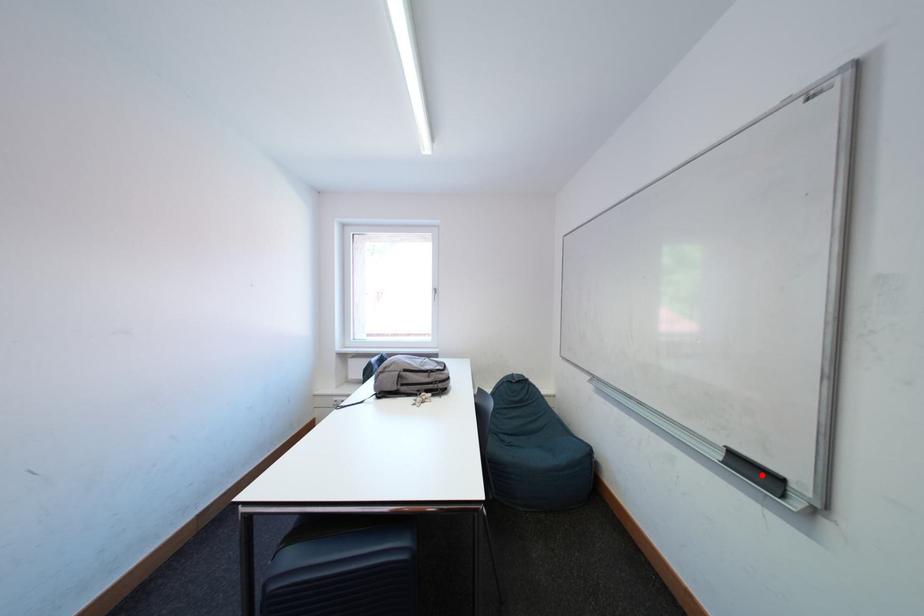
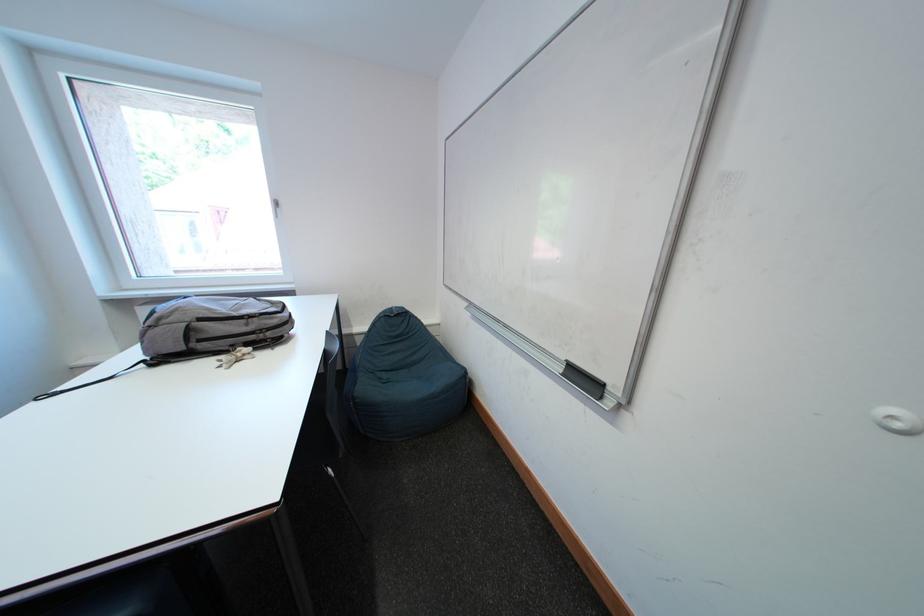
The point at the highlighted location is marked in the first image. Where is the corresponding point in the second image?

(591, 383)